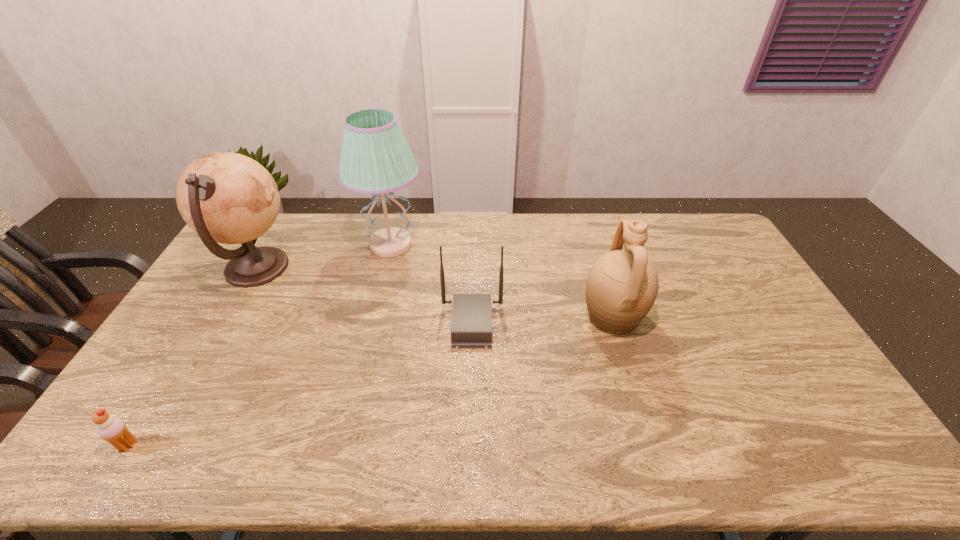
Identify the location of blank area located on the right of the pitcher. (759, 316).

The width and height of the screenshot is (960, 540). In order to click on free region located 0.160m on the back of the router to connect cables in this screenshot , I will do `click(555, 323)`.

This screenshot has width=960, height=540. In order to click on lamp situated at the far edge in this screenshot , I will do 375,159.

Identify the location of globe that is at the far edge. (225, 197).

The image size is (960, 540). Identify the location of object that is at the near edge. (112, 429).

The image size is (960, 540). Identify the location of globe at the left edge. (225, 197).

Where is `icecream present at the left edge`? icecream present at the left edge is located at coordinates (112, 429).

Image resolution: width=960 pixels, height=540 pixels. Find the location of `object that is at the far left corner`. object that is at the far left corner is located at coordinates (x=225, y=197).

Where is `object located in the near left corner section of the desktop`? object located in the near left corner section of the desktop is located at coordinates (112, 429).

This screenshot has height=540, width=960. Identify the location of free space at the far edge. (486, 217).